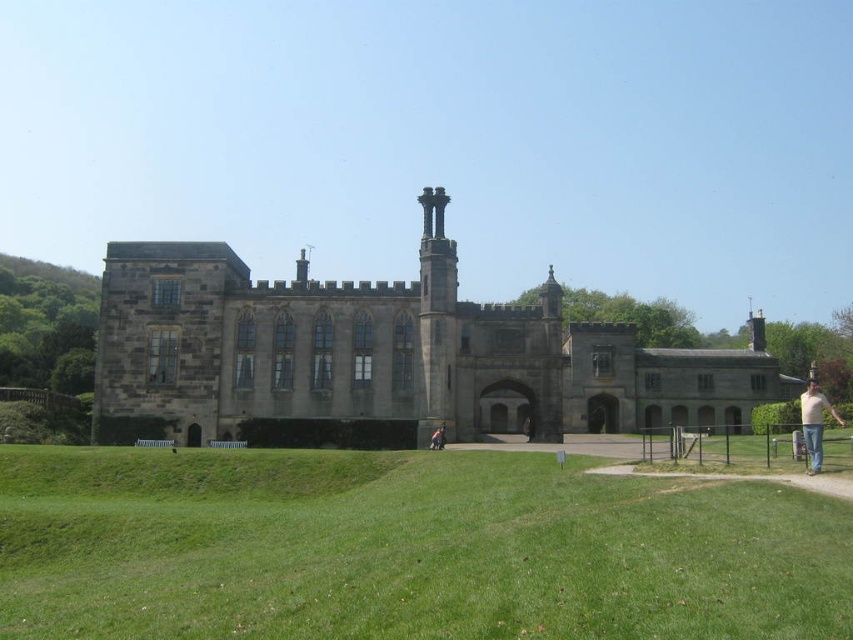
You are standing in front of a grand stone building with a medieval design. You see green grassy at lower center and light beige jeans at lower right. Which object is positioned to the left of the other?

The green grassy at lower center is to the left of light beige jeans at lower right.